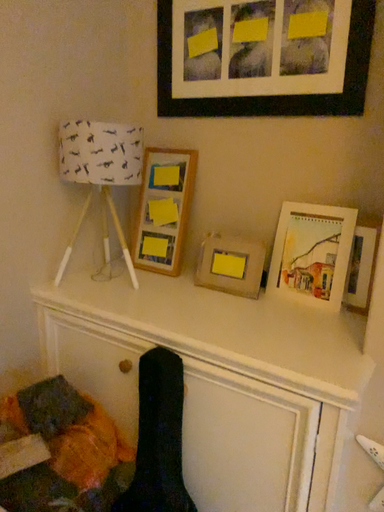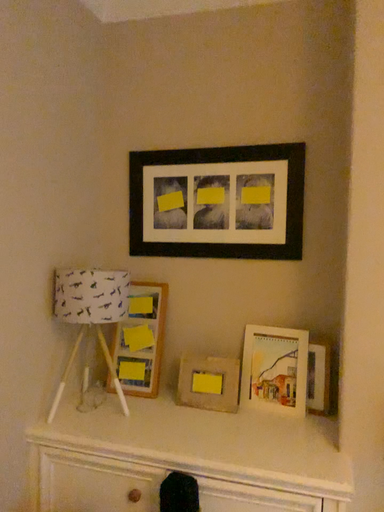
Question: How did the camera likely rotate when shooting the video?

Choices:
 (A) rotated downward
 (B) rotated upward

Answer: (B)